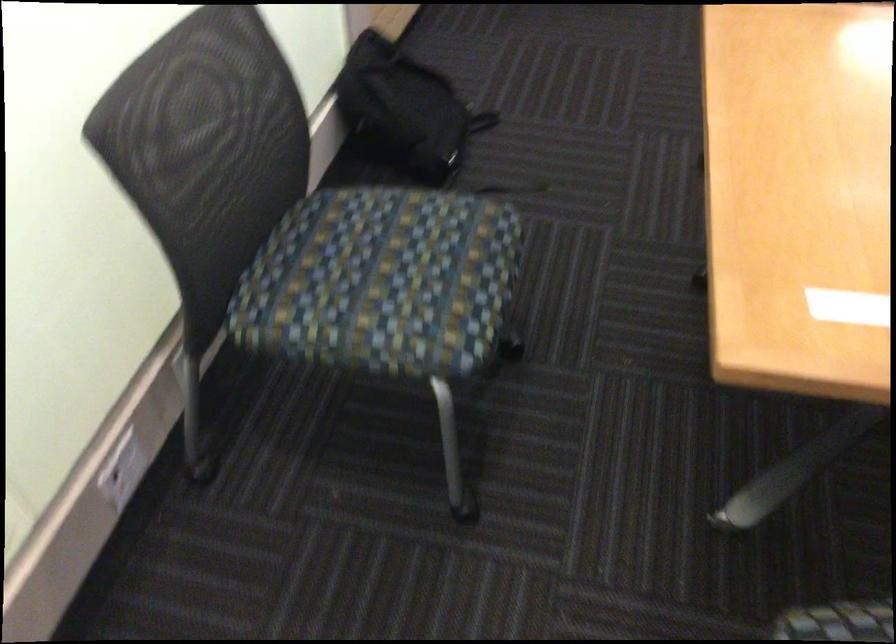
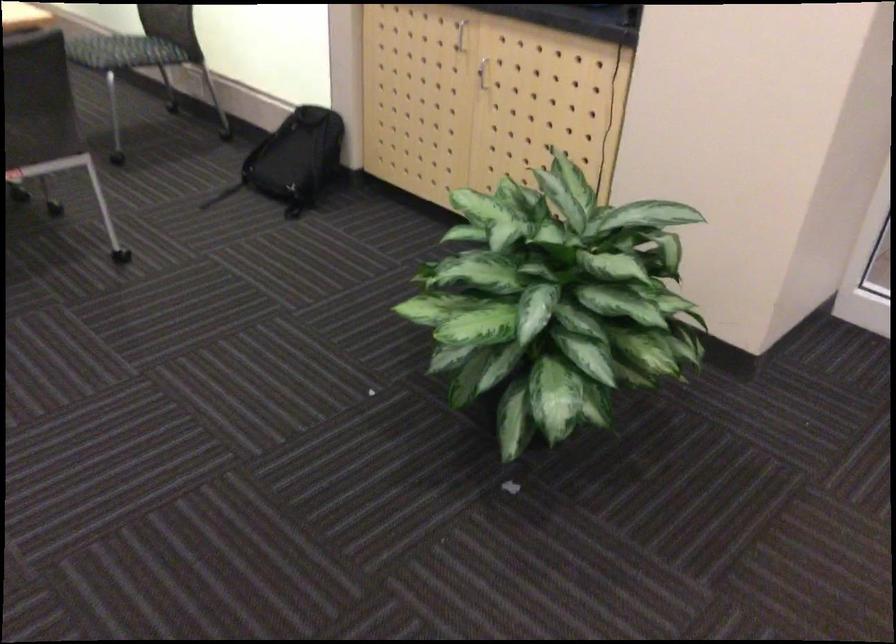
Where in the second image is the point corresponding to pixel 435 77 from the first image?

(293, 160)